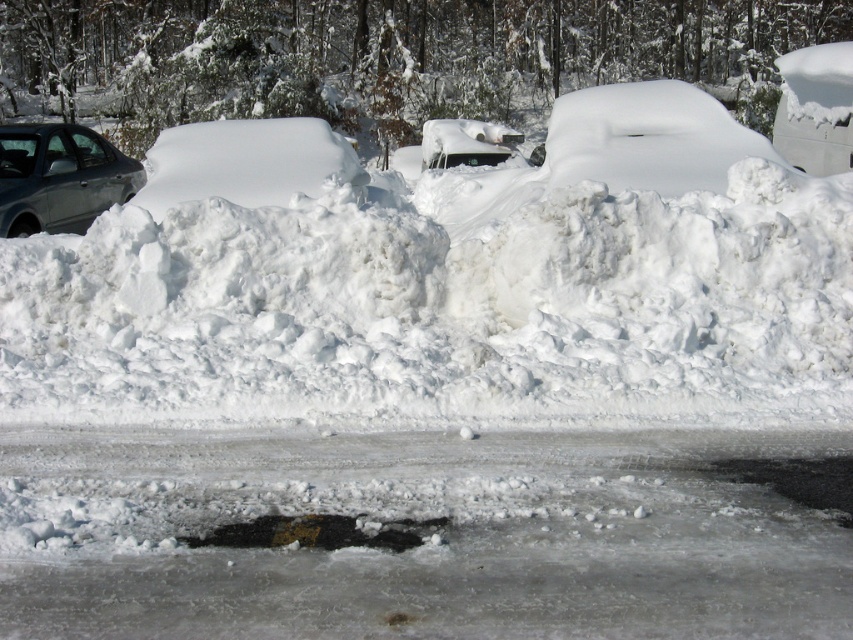
Between matte gray sedan at left and white glossy car at center, which one has more height?

With more height is white glossy car at center.

Between matte gray sedan at left and white glossy car at center, which one has less height?

Standing shorter between the two is matte gray sedan at left.

Is point (38, 195) positioned after point (459, 141)?

No, it is in front of (459, 141).

This screenshot has height=640, width=853. Identify the location of matte gray sedan at left. (59, 177).